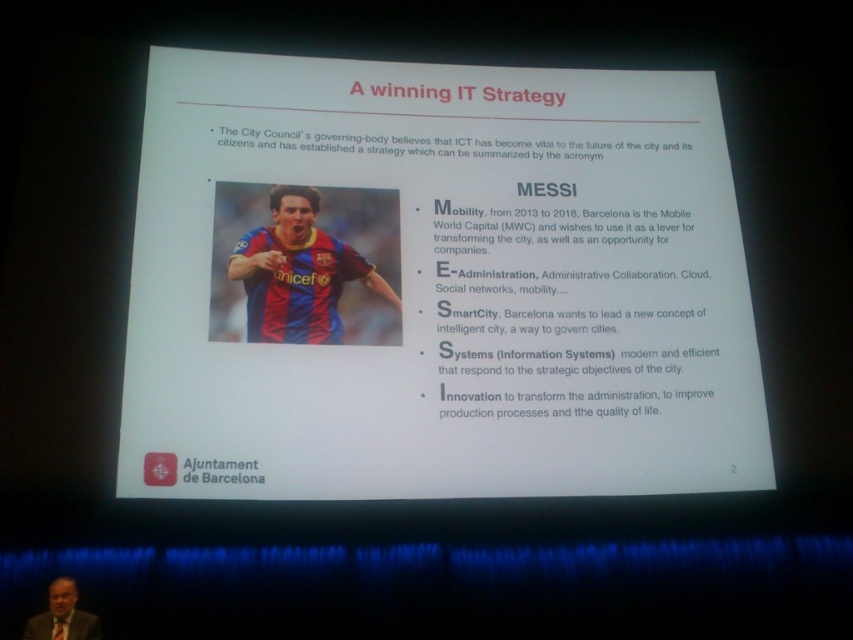
Is point (212, 404) positioned behind point (51, 602)?

Yes.

Is blue jersey at left thinner than matte black suit at lower left?

In fact, blue jersey at left might be wider than matte black suit at lower left.

Between point (573, 484) and point (97, 628), which one is positioned in front?

Positioned in front is point (97, 628).

Find the location of `blue jersey at left`. blue jersey at left is located at coordinates (434, 284).

Does blue and red jersey at center have a larger size compared to matte black suit at lower left?

Indeed, blue and red jersey at center has a larger size compared to matte black suit at lower left.

Which is above, blue and red jersey at center or matte black suit at lower left?

Positioned higher is blue and red jersey at center.

Is point (225, 246) behind point (33, 634)?

Yes, point (225, 246) is farther from viewer.

In order to click on blue and red jersey at center in this screenshot , I will do `click(320, 268)`.

Is blue jersey at left smaller than blue and red jersey at center?

No, blue jersey at left is not smaller than blue and red jersey at center.

Which is in front, point (285, 241) or point (323, 284)?

Point (323, 284)

You are a GUI agent. You are given a task and a screenshot of the screen. Output one action in this format:
    pyautogui.click(x=<x>, y=<y>)
    Task: Click on the blue jersey at left
    This screenshot has width=853, height=640.
    Given the screenshot: What is the action you would take?
    pyautogui.click(x=434, y=284)